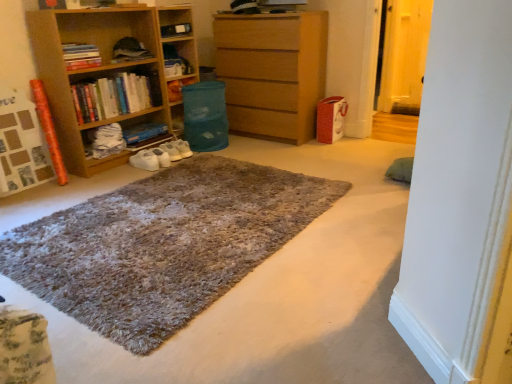
Question: Is hardcover books at left, which is the second book in bottom-to-top order, spatially inside shaggy carpet at center, or outside of it?

Choices:
 (A) inside
 (B) outside

Answer: (B)

Question: Considering the positions of point (132, 74) and point (195, 296), is point (132, 74) closer or farther from the camera than point (195, 296)?

Choices:
 (A) farther
 (B) closer

Answer: (A)

Question: Which object is positioned farthest from the wooden bookshelf at left, the first shelf when ordered from left to right?

Choices:
 (A) blue cardboard book at center, arranged as the 1th book when ordered from the bottom
 (B) shaggy carpet at center
 (C) hardcover books at left, marked as the first book in a top-to-bottom arrangement
 (D) wooden chest of drawers at center
 (E) hardcover books at left, the second book viewed from the top

Answer: (B)

Question: Which is farther from the hardcover books at left, which is counted as the 3th book, starting from the bottom?

Choices:
 (A) wooden bookshelf at left, marked as the second shelf in a right-to-left arrangement
 (B) shaggy carpet at center
 (C) matte plastic water at center, which is the first shelf in right-to-left order
 (D) hardcover books at left, the second book viewed from the top
 (E) wooden chest of drawers at center

Answer: (B)